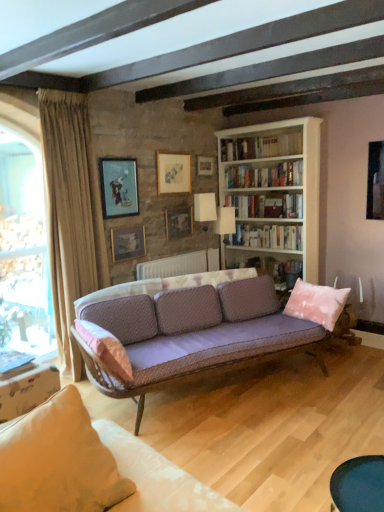
Question: Considering the positions of pink velvet pillow at right, marked as the 1th pillow in a back-to-front arrangement, and white glossy bookshelf at upper center, the 5th book when ordered from bottom to top, in the image, is pink velvet pillow at right, marked as the 1th pillow in a back-to-front arrangement, bigger or smaller than white glossy bookshelf at upper center, the 5th book when ordered from bottom to top,?

Choices:
 (A) big
 (B) small

Answer: (A)

Question: Visually, is pink velvet pillow at right, the second pillow positioned from the front, positioned to the left or to the right of white glossy bookshelf at upper center, marked as the first book in a top-to-bottom arrangement?

Choices:
 (A) right
 (B) left

Answer: (A)

Question: Considering the real-world distances, which object is closest to the matte gold picture frame at center, placed as the 4th picture frame when sorted from right to left?

Choices:
 (A) white paper bookshelf at upper center, which appears as the 4th book when viewed from the top
 (B) wooden table at lower left, the first table in the back-to-front sequence
 (C) matte blue painting at upper left, positioned as the 5th picture frame in right-to-left order
 (D) pink velvet pillow at right, positioned as the second pillow in left-to-right order
 (E) white fabric lampshade at center

Answer: (C)

Question: Which object is the closest to the smooth dark blue table at lower right, which appears as the second table when viewed from the left?

Choices:
 (A) white fabric lampshade at center
 (B) pink velvet pillow at right, which is the first pillow from right to left
 (C) hardcover books at center, the 4th book in the bottom-to-top sequence
 (D) wooden picture frame at upper center, which is counted as the fourth picture frame, starting from the left
 (E) hardcover book at center, which is the 3th book in top-to-bottom order

Answer: (B)